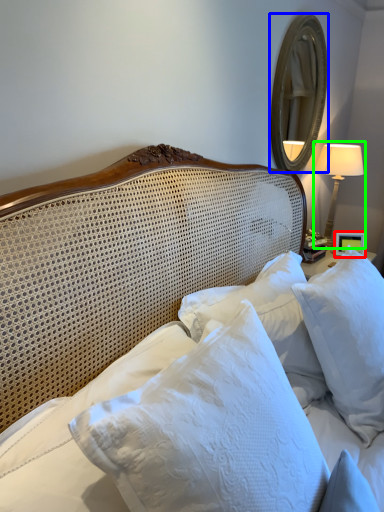
Question: Which object is positioned farthest from picture frame (highlighted by a red box)? Select from mirror (highlighted by a blue box) and bedside lamp (highlighted by a green box).

Choices:
 (A) mirror
 (B) bedside lamp

Answer: (A)